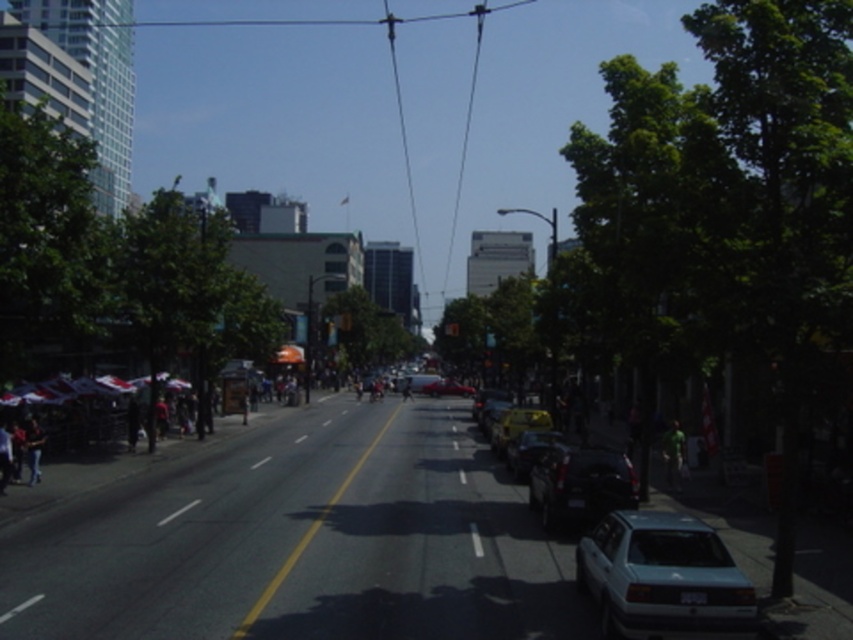
Looking at this image, does black asphalt road at center appear under shiny black sedan at center?

Yes.

Where is `black asphalt road at center`? black asphalt road at center is located at coordinates (306, 536).

Between shiny black sedan at center and jeans at left, which one is positioned lower?

shiny black sedan at center is lower down.

Is shiny black sedan at center wider than jeans at left?

Indeed, shiny black sedan at center has a greater width compared to jeans at left.

Who is more forward, (x=514, y=449) or (x=39, y=448)?

Point (x=39, y=448) is more forward.

At what (x,y) coordinates should I click in order to perform the action: click on shiny black sedan at center. Please return your answer as a coordinate pair (x, y). Looking at the image, I should click on (529, 451).

Can you confirm if light blue matte sedan at lower right is thinner than shiny black car at center?

Yes.

Locate an element on the screen. The height and width of the screenshot is (640, 853). light blue matte sedan at lower right is located at coordinates (663, 579).

Which is behind, point (575, 572) or point (575, 460)?

The point (575, 460) is behind.

Where is `light blue matte sedan at lower right`? This screenshot has width=853, height=640. light blue matte sedan at lower right is located at coordinates (663, 579).